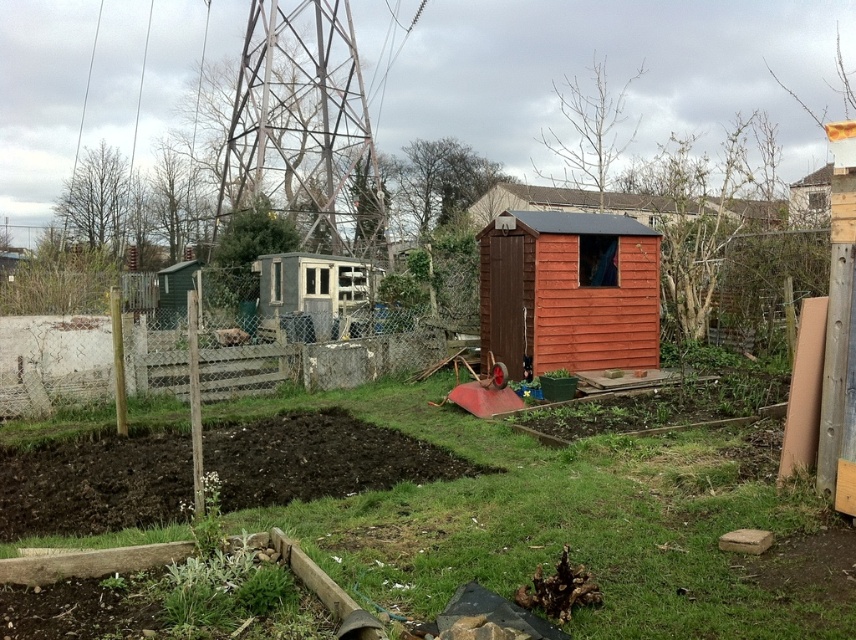
You are a gardener who needs to move a wheelbarrow from the orange wood shed at center to the gray shed to the left. The wheelbarrow is 1.2 meters wide. Can you pass through the space between the two sheds?

The distance between the orange wood shed at center and the gray shed to the left is 9.98 meters. Since the wheelbarrow is only 1.2 meters wide, there is ample space to pass through the 9.98 meters gap between the two sheds.

You are a gardener who wants to install a new fence that is exactly the same height as the rusty metal shed at center. Can the wooden fence at center be used as a reference for the desired height? Please explain.

The wooden fence at center is shorter than the rusty metal shed at center. Therefore, the wooden fence at center cannot be used as a reference for the desired height because it is shorter than the rusty metal shed at center.

You are a gardener who wants to access the rusty metal shed at center. There is a wooden fence at center blocking your path. Which direction should you move to go around the fence and reach the shed?

Since the wooden fence at center is to the right of the rusty metal shed at center, you should move to the left side of the wooden fence at center to go around it and reach the shed.